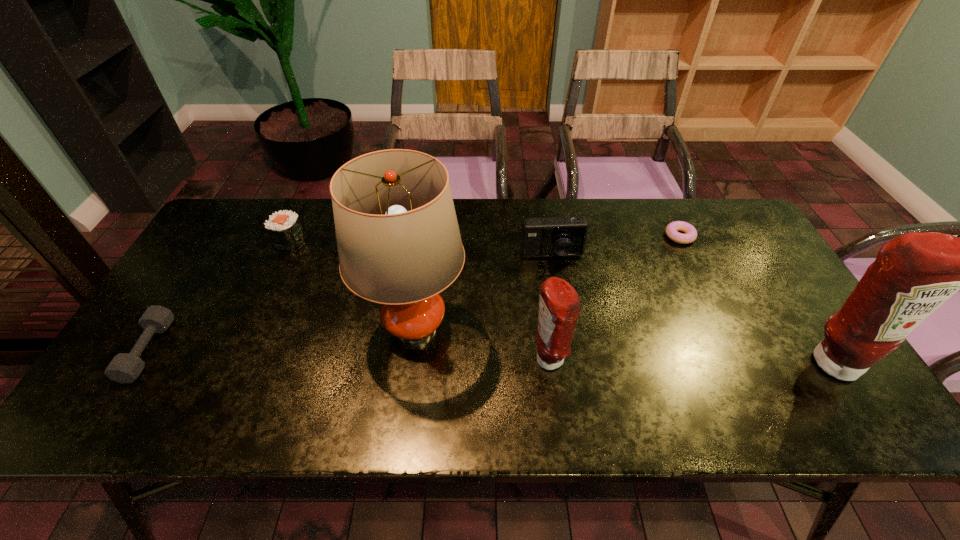
Where is `unoccupied position between the sixth object from left to right and the shorter condiment`? This screenshot has height=540, width=960. unoccupied position between the sixth object from left to right and the shorter condiment is located at coordinates (614, 298).

Identify the location of vacant region between the dumbbell and the sushi. (219, 295).

Where is `the third closest object to the second object from left to right`? The height and width of the screenshot is (540, 960). the third closest object to the second object from left to right is located at coordinates (552, 236).

Image resolution: width=960 pixels, height=540 pixels. Find the location of `object that is the second closest one to the leftmost object`. object that is the second closest one to the leftmost object is located at coordinates (398, 240).

Where is `vacant region that satisfies the following two spatial constraints: 1. on the front side of the rightmost object; 2. on the right side of the fifth tallest object`? vacant region that satisfies the following two spatial constraints: 1. on the front side of the rightmost object; 2. on the right side of the fifth tallest object is located at coordinates (234, 362).